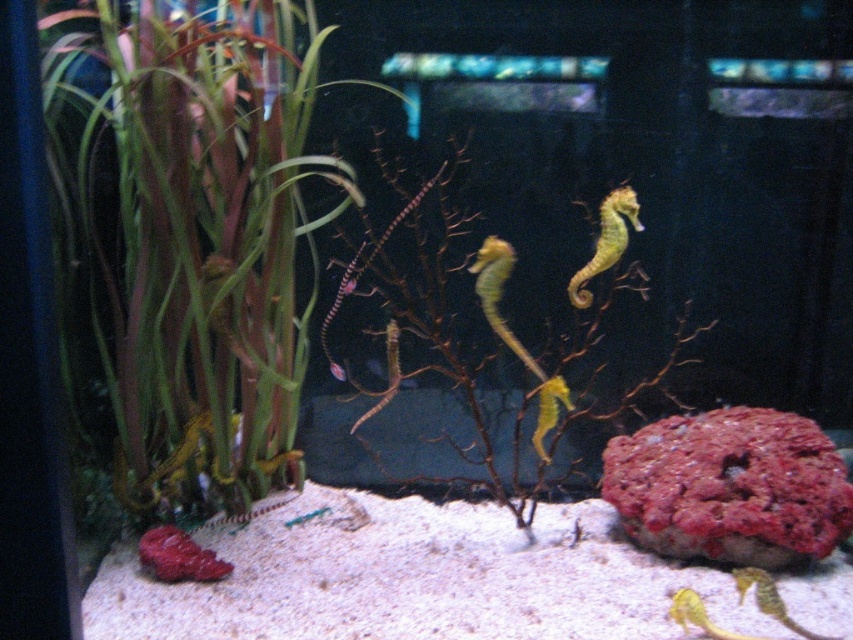
Between smooth yellow seahorse at center and green matte seahorse at center, which one is positioned higher?

smooth yellow seahorse at center is above.

Who is shorter, smooth yellow seahorse at center or green matte seahorse at center?

green matte seahorse at center is shorter.

At what (x,y) coordinates should I click in order to perform the action: click on smooth yellow seahorse at center. Please return your answer as a coordinate pair (x, y). This screenshot has height=640, width=853. Looking at the image, I should click on (606, 241).

Is green matte plant at left further to camera compared to green matte seahorse at center?

That is False.

Identify the location of green matte plant at left. (187, 236).

Is yellow matte seahorse at center thinner than green matte seahorse at center?

Incorrect, yellow matte seahorse at center's width is not less than green matte seahorse at center's.

Which is above, yellow matte seahorse at center or green matte seahorse at center?

yellow matte seahorse at center is higher up.

Does point (561, 396) come behind point (329, 371)?

That is False.

Find the location of a particular element. Image resolution: width=853 pixels, height=640 pixels. yellow matte seahorse at center is located at coordinates (514, 333).